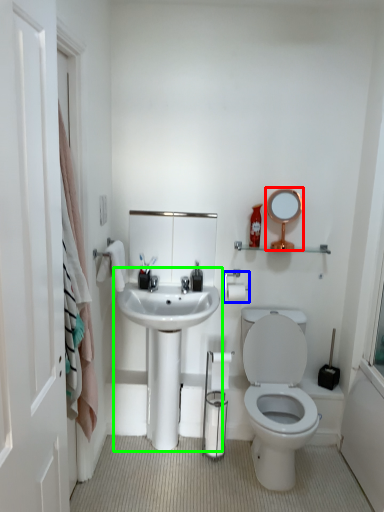
Question: Considering the real-world distances, which object is farthest from mirror (highlighted by a red box)? towel bar (highlighted by a blue box) or sink (highlighted by a green box)?

Choices:
 (A) towel bar
 (B) sink

Answer: (B)